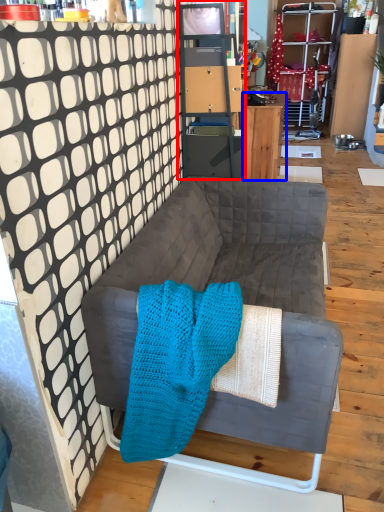
Question: Which object is further to the camera taking this photo, cabinetry (highlighted by a red box) or desk (highlighted by a blue box)?

Choices:
 (A) cabinetry
 (B) desk

Answer: (B)